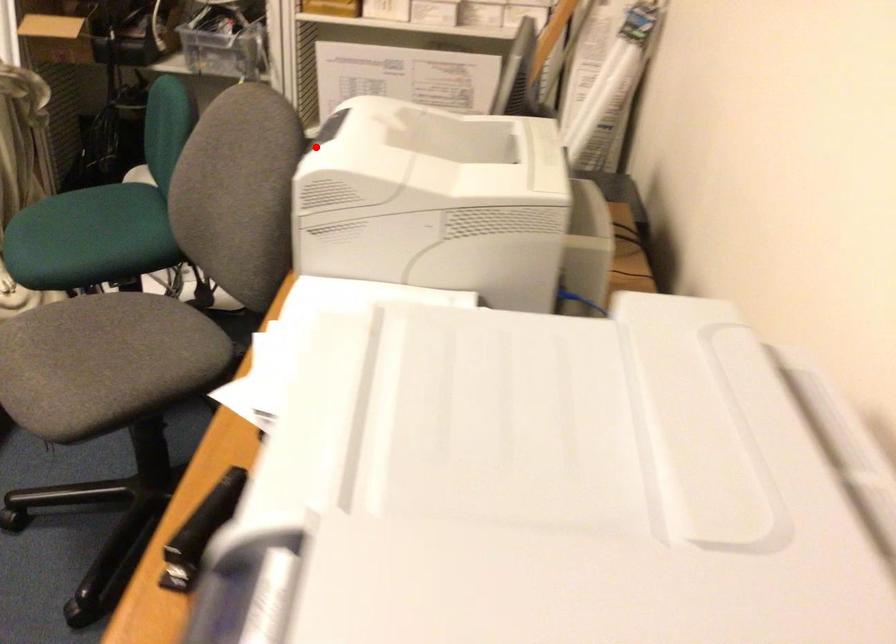
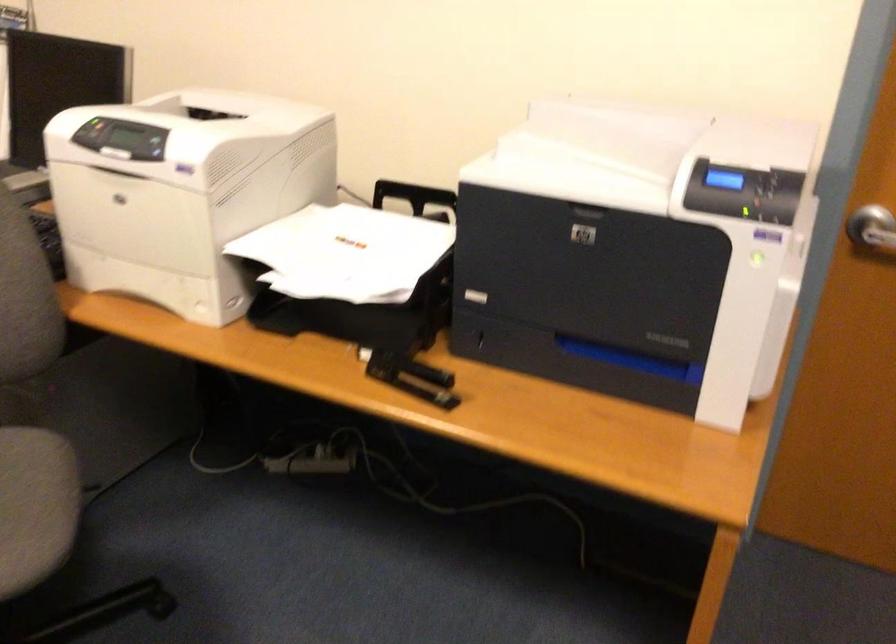
Question: I am providing you with two images of the same scene from different viewpoints. Given a red point in image1, look at the same physical point in image2. Is it:

Choices:
 (A) Closer to the viewpoint
 (B) Farther from the viewpoint

Answer: (B)